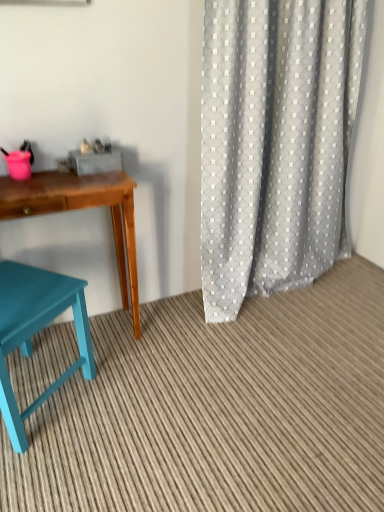
Find the location of a particular element. empty space that is ontop of teal wood stool at lower left (from a real-world perspective) is located at coordinates (240, 371).